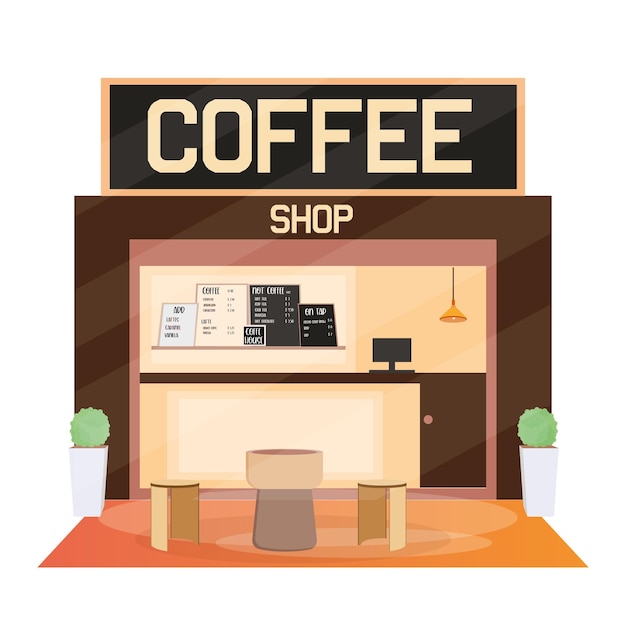
The width and height of the screenshot is (626, 626). In order to click on lamp in this screenshot , I will do `click(451, 309)`.